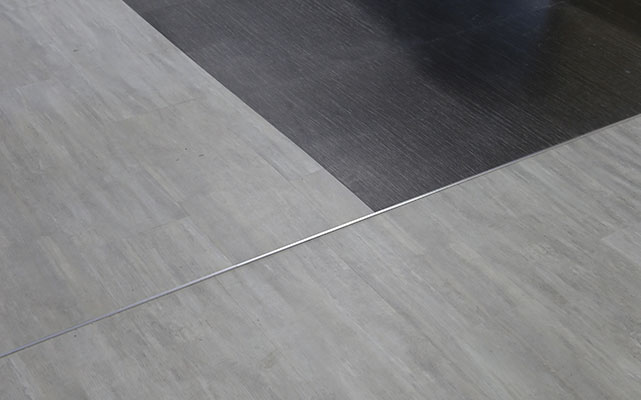
Image resolution: width=641 pixels, height=400 pixels. I want to click on light reflection on dark laminate flooring, so click(x=345, y=165).